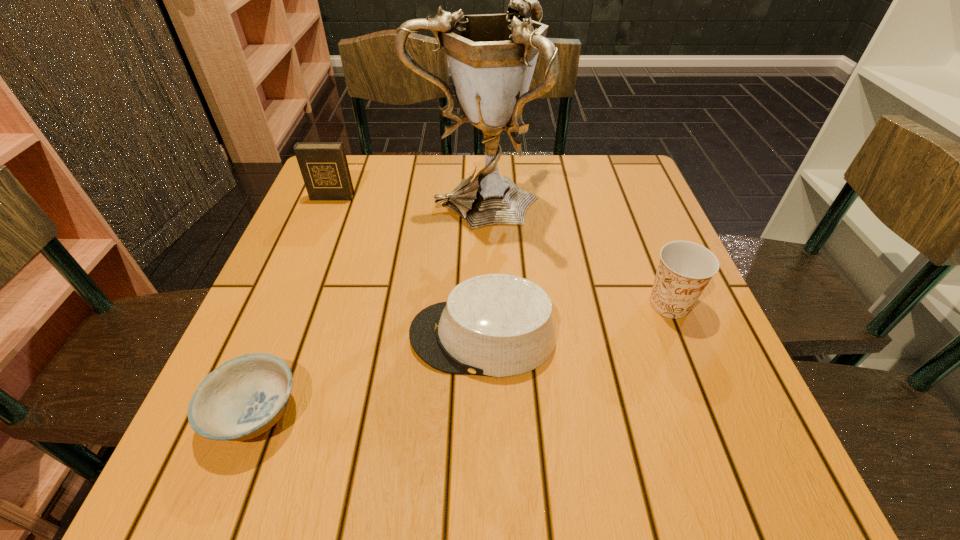
I want to click on blank space that satisfies the following two spatial constraints: 1. on the front cover of the rightmost object; 2. on the right side of the second tallest object, so click(288, 303).

Image resolution: width=960 pixels, height=540 pixels. In order to click on free space that satisfies the following two spatial constraints: 1. on the front-facing side of the fourth tallest object; 2. on the front side of the bowl in this screenshot , I will do `click(484, 412)`.

Locate an element on the screen. This screenshot has width=960, height=540. free spot that satisfies the following two spatial constraints: 1. on the front cover of the bowl; 2. on the right side of the diary is located at coordinates (244, 412).